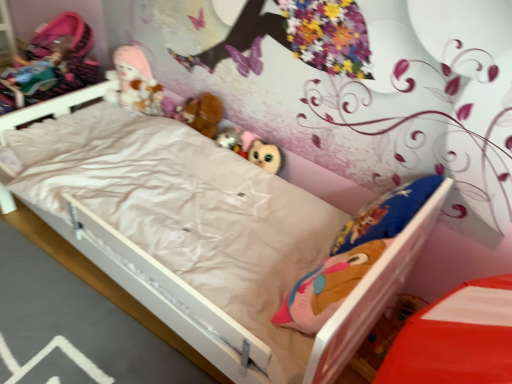
What do you see at coordinates (146, 96) in the screenshot?
I see `fluffy plush toys at upper center, which is counted as the third toy, starting from the bottom` at bounding box center [146, 96].

Where is `matte pink fabric doll at upper left, which is the 2th doll from right to left`? This screenshot has height=384, width=512. matte pink fabric doll at upper left, which is the 2th doll from right to left is located at coordinates (137, 82).

How much space does matte pink fabric doll at upper left, which is the 2th doll from right to left, occupy vertically?

11.14 inches.

Locate an element on the screen. This screenshot has width=512, height=384. fuzzy fabric plush at center, marked as the 2th toy in a front-to-back arrangement is located at coordinates (228, 137).

Which of these two, fuzzy fabric plush at center, the 2th toy when ordered from left to right, or matte plush owl at center, positioned as the 3th toy in left-to-right order, is wider?

fuzzy fabric plush at center, the 2th toy when ordered from left to right.

From the image's perspective, which one is positioned higher, fuzzy fabric plush at center, the 2th toy positioned from the bottom, or matte plush owl at center, which is counted as the first toy, starting from the bottom?

fuzzy fabric plush at center, the 2th toy positioned from the bottom, from the image's perspective.

Considering the sizes of objects fuzzy fabric plush at center, the 2th toy when ordered from left to right, and matte plush owl at center, the first toy from the front, in the image provided, who is taller, fuzzy fabric plush at center, the 2th toy when ordered from left to right, or matte plush owl at center, the first toy from the front,?

matte plush owl at center, the first toy from the front, is taller.

Is fuzzy fabric plush at center, arranged as the second toy when viewed from the top, facing away from matte pink fabric doll at upper left, the first doll from the left?

fuzzy fabric plush at center, arranged as the second toy when viewed from the top, is not turned away from matte pink fabric doll at upper left, the first doll from the left.

From the image's perspective, is fuzzy fabric plush at center, the 2th toy positioned from the bottom, located beneath matte pink fabric doll at upper left, the first doll from the left?

Yes.

Are fuzzy fabric plush at center, the 2th toy positioned from the bottom, and matte pink fabric doll at upper left, the first doll from the left, making contact?

No, fuzzy fabric plush at center, the 2th toy positioned from the bottom, is not next to matte pink fabric doll at upper left, the first doll from the left.

Which is behind, fuzzy fabric plush at center, arranged as the second toy when viewed from the top, or matte pink fabric doll at upper left, which is the 2th doll from right to left?

matte pink fabric doll at upper left, which is the 2th doll from right to left, is further from the camera.

Does matte plush owl at center, acting as the third toy starting from the top, touch white matte bed at center?

No, matte plush owl at center, acting as the third toy starting from the top, is not touching white matte bed at center.

From the image's perspective, is matte plush owl at center, positioned as the 3th toy in left-to-right order, located above or below white matte bed at center?

matte plush owl at center, positioned as the 3th toy in left-to-right order, is situated higher than white matte bed at center in the image.

From a real-world perspective, is matte plush owl at center, acting as the third toy starting from the top, physically located above or below white matte bed at center?

Clearly, from a real-world perspective, matte plush owl at center, acting as the third toy starting from the top, is above white matte bed at center.

From the picture: How different are the orientations of matte plush owl at center, the first toy from the front, and white matte bed at center in degrees?

The facing directions of matte plush owl at center, the first toy from the front, and white matte bed at center are 1.68 degrees apart.

Between matte pink fabric doll at upper left, which is the 2th doll from right to left, and white matte bed at center, which one has smaller size?

With smaller size is matte pink fabric doll at upper left, which is the 2th doll from right to left.

Is there a large distance between matte pink fabric doll at upper left, the first doll from the left, and white matte bed at center?

No, matte pink fabric doll at upper left, the first doll from the left, is in close proximity to white matte bed at center.

From a real-world perspective, between matte pink fabric doll at upper left, which is the 2th doll from right to left, and white matte bed at center, who is vertically lower?

In real-world perspective, white matte bed at center is lower.

Consider the image. Is matte pink fabric doll at upper left, the first doll from the left, looking in the opposite direction of white matte bed at center?

No, matte pink fabric doll at upper left, the first doll from the left, is not facing away from white matte bed at center.

Is matte plush owl at center, positioned as the 3th toy in left-to-right order, in front of or behind fluffy plush toys at upper center, which is the first toy from left to right, in the image?

Visually, matte plush owl at center, positioned as the 3th toy in left-to-right order, is located in front of fluffy plush toys at upper center, which is the first toy from left to right.

Is matte plush owl at center, the first toy from the front, not inside fluffy plush toys at upper center, the 3th toy viewed from the front?

Yes, matte plush owl at center, the first toy from the front, is outside of fluffy plush toys at upper center, the 3th toy viewed from the front.

Is matte plush owl at center, the first toy from the front, smaller than fluffy plush toys at upper center, the 3th toy viewed from the front?

Actually, matte plush owl at center, the first toy from the front, might be larger than fluffy plush toys at upper center, the 3th toy viewed from the front.

Is matte plush owl at center, the first toy from the front, beside fluffy plush toys at upper center, the 3th toy viewed from the front?

There is a gap between matte plush owl at center, the first toy from the front, and fluffy plush toys at upper center, the 3th toy viewed from the front.

Considering the positions of objects fuzzy fabric plush at center, the 2th toy viewed from the right, and brown plush at center, the second doll from the left, in the image provided, who is behind, fuzzy fabric plush at center, the 2th toy viewed from the right, or brown plush at center, the second doll from the left,?

brown plush at center, the second doll from the left, is behind.

Considering the relative sizes of fuzzy fabric plush at center, arranged as the second toy when viewed from the top, and brown plush at center, arranged as the first doll when viewed from the right, in the image provided, is fuzzy fabric plush at center, arranged as the second toy when viewed from the top, shorter than brown plush at center, arranged as the first doll when viewed from the right,?

Correct, fuzzy fabric plush at center, arranged as the second toy when viewed from the top, is not as tall as brown plush at center, arranged as the first doll when viewed from the right.

Considering the points (236, 138) and (206, 131), which point is in front, point (236, 138) or point (206, 131)?

Positioned in front is point (236, 138).

From a real-world perspective, relative to fuzzy fabric plush at center, the 2th toy positioned from the bottom, is matte pink fabric doll at upper left, which is the 2th doll from right to left, vertically above or below?

matte pink fabric doll at upper left, which is the 2th doll from right to left, is situated higher than fuzzy fabric plush at center, the 2th toy positioned from the bottom, in the real world.

Would you consider matte pink fabric doll at upper left, which is the 2th doll from right to left, to be distant from fuzzy fabric plush at center, the 2th toy positioned from the bottom?

matte pink fabric doll at upper left, which is the 2th doll from right to left, is near fuzzy fabric plush at center, the 2th toy positioned from the bottom, not far away.

From the fuzzy fabric plush at center, the 2th toy viewed from the right, count 2nd dolls backward and point to it. Please provide its 2D coordinates.

[(137, 82)]

This screenshot has height=384, width=512. I want to click on toy that appears in front of the fuzzy fabric plush at center, marked as the 2th toy in a front-to-back arrangement, so click(x=265, y=156).

What are the coordinates of `the 2nd doll positioned above the fuzzy fabric plush at center, positioned as the 2th toy in back-to-front order (from the image's perspective)` in the screenshot? It's located at 137,82.

Which object lies further to the anchor point fuzzy fabric plush at center, the 2th toy when ordered from left to right, brown plush at center, arranged as the first doll when viewed from the right, or matte plush owl at center, placed as the third toy when sorted from back to front?

brown plush at center, arranged as the first doll when viewed from the right, lies further to fuzzy fabric plush at center, the 2th toy when ordered from left to right, than the other object.

From the image, which object appears to be farther from matte pink fabric doll at upper left, which is the 2th doll from right to left, fuzzy fabric plush at center, the 2th toy when ordered from left to right, or matte plush owl at center, placed as the third toy when sorted from back to front?

matte plush owl at center, placed as the third toy when sorted from back to front.

Which object lies nearer to the anchor point fluffy plush toys at upper center, the 3th toy viewed from the front, brown plush at center, the second doll from the left, or matte pink fabric doll at upper left, the first doll from the left?

The object closer to fluffy plush toys at upper center, the 3th toy viewed from the front, is matte pink fabric doll at upper left, the first doll from the left.

Considering their positions, is white matte bed at center positioned further to fuzzy fabric plush at center, positioned as the 2th toy in back-to-front order, than matte pink fabric doll at upper left, which is the 2th doll from right to left?

The object further to fuzzy fabric plush at center, positioned as the 2th toy in back-to-front order, is white matte bed at center.

In the scene shown: When comparing their distances from fluffy plush toys at upper center, which is counted as the third toy, starting from the bottom, does white matte bed at center or brown plush at center, the second doll from the left, seem further?

white matte bed at center lies further to fluffy plush toys at upper center, which is counted as the third toy, starting from the bottom, than the other object.

When comparing their distances from matte plush owl at center, which is counted as the first toy, starting from the bottom, does fluffy plush toys at upper center, which is the first toy from left to right, or brown plush at center, arranged as the first doll when viewed from the right, seem further?

Result: fluffy plush toys at upper center, which is the first toy from left to right.

Which object lies nearer to the anchor point matte pink fabric doll at upper left, the first doll from the left, white matte bed at center or fuzzy fabric plush at center, arranged as the second toy when viewed from the top?

fuzzy fabric plush at center, arranged as the second toy when viewed from the top, is positioned closer to the anchor matte pink fabric doll at upper left, the first doll from the left.

Which object lies nearer to the anchor point brown plush at center, arranged as the first doll when viewed from the right, fluffy plush toys at upper center, which is counted as the third toy, starting from the bottom, or fuzzy fabric plush at center, marked as the 2th toy in a front-to-back arrangement?

fuzzy fabric plush at center, marked as the 2th toy in a front-to-back arrangement, lies closer to brown plush at center, arranged as the first doll when viewed from the right, than the other object.

The width and height of the screenshot is (512, 384). What are the coordinates of `toy between fluffy plush toys at upper center, which is the 3th toy from right to left, and matte plush owl at center, positioned as the 3th toy in left-to-right order, from left to right` in the screenshot? It's located at (228, 137).

You are a GUI agent. You are given a task and a screenshot of the screen. Output one action in this format:
    pyautogui.click(x=<x>, y=<y>)
    Task: Click on the toy between brown plush at center, the second doll from the left, and matte plush owl at center, acting as the third toy starting from the top
    Image resolution: width=512 pixels, height=384 pixels.
    Given the screenshot: What is the action you would take?
    pyautogui.click(x=228, y=137)

This screenshot has width=512, height=384. Find the location of `doll situated between fluffy plush toys at upper center, which is the 3th toy from right to left, and matte plush owl at center, which is counted as the first toy, starting from the bottom, from left to right`. doll situated between fluffy plush toys at upper center, which is the 3th toy from right to left, and matte plush owl at center, which is counted as the first toy, starting from the bottom, from left to right is located at coordinates [x=202, y=113].

Identify the location of doll between matte pink fabric doll at upper left, which is the 2th doll from right to left, and white matte bed at center from top to bottom. (202, 113).